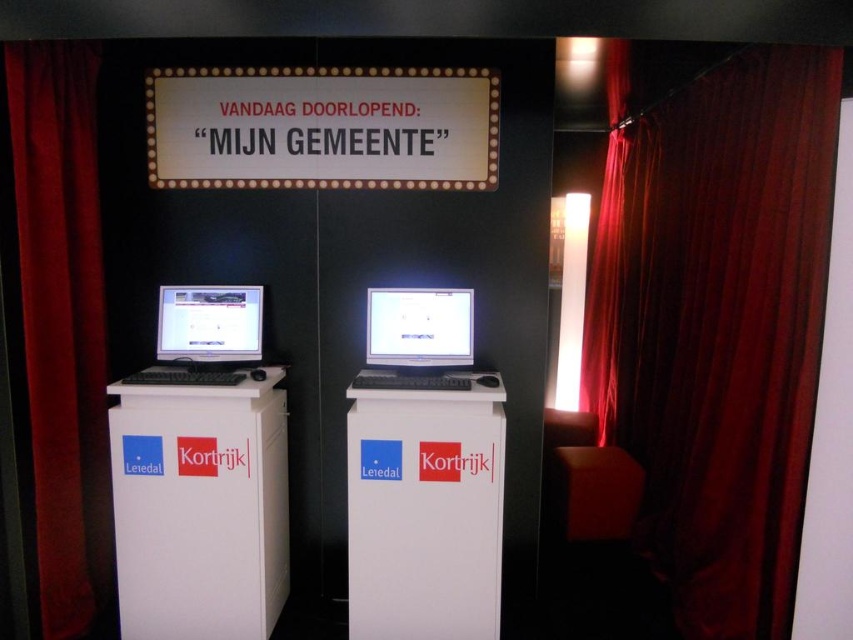
Question: Among these objects, which one is nearest to the camera?

Choices:
 (A) velvet red curtain at left
 (B) velvet dark red curtain at right
 (C) matte black monitor at center
 (D) matte white monitor at left

Answer: (B)

Question: Which object is farther from the camera taking this photo?

Choices:
 (A) velvet red curtain at left
 (B) matte white monitor at left
 (C) white glossy pillar at center
 (D) velvet dark red curtain at right

Answer: (B)

Question: Estimate the real-world distances between objects in this image. Which object is closer to the matte black monitor at center?

Choices:
 (A) velvet red curtain at left
 (B) white glossy pillar at center
 (C) matte white monitor at left
 (D) velvet dark red curtain at right

Answer: (B)

Question: Does velvet dark red curtain at right have a greater width compared to white glossy pillar at center?

Choices:
 (A) yes
 (B) no

Answer: (B)

Question: Can you confirm if velvet dark red curtain at right is positioned above matte black monitor at center?

Choices:
 (A) no
 (B) yes

Answer: (B)

Question: Is white glossy pillar at center wider than matte black monitor at center?

Choices:
 (A) no
 (B) yes

Answer: (B)